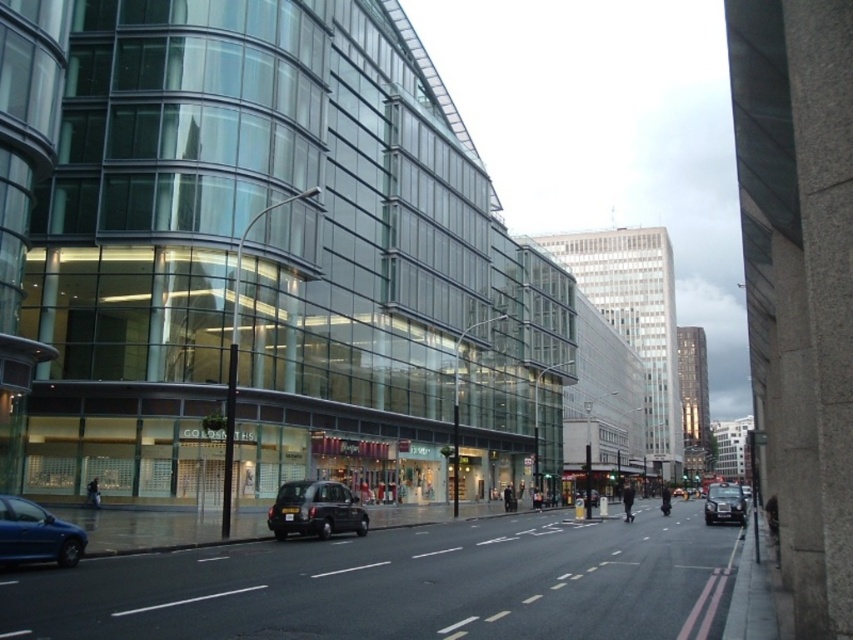
Question: Is black matte taxi at center to the right of black metallic car at center from the viewer's perspective?

Choices:
 (A) yes
 (B) no

Answer: (B)

Question: Among these objects, which one is farthest from the camera?

Choices:
 (A) black matte taxi at center
 (B) metallic blue car at lower left
 (C) black metallic car at center

Answer: (C)

Question: Is metallic blue car at lower left in front of black metallic car at center?

Choices:
 (A) yes
 (B) no

Answer: (A)

Question: Which of the following is the closest to the observer?

Choices:
 (A) (7, 548)
 (B) (312, 500)
 (C) (717, 492)

Answer: (A)

Question: Considering the relative positions of black matte taxi at center and metallic blue car at lower left in the image provided, where is black matte taxi at center located with respect to metallic blue car at lower left?

Choices:
 (A) above
 (B) below

Answer: (B)

Question: Which of the following is the farthest from the observer?

Choices:
 (A) black matte taxi at center
 (B) metallic blue car at lower left

Answer: (A)